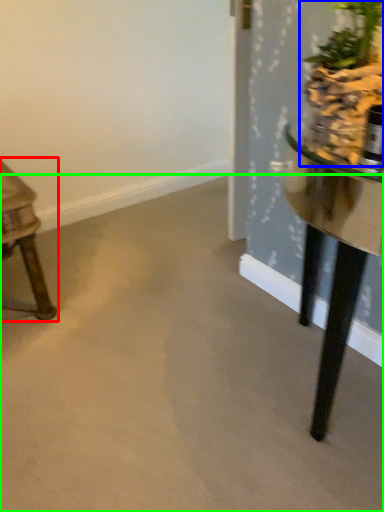
Question: Based on their relative distances, which object is nearer to table (highlighted by a red box)? Choose from houseplant (highlighted by a blue box) and concrete (highlighted by a green box).

Choices:
 (A) houseplant
 (B) concrete

Answer: (B)